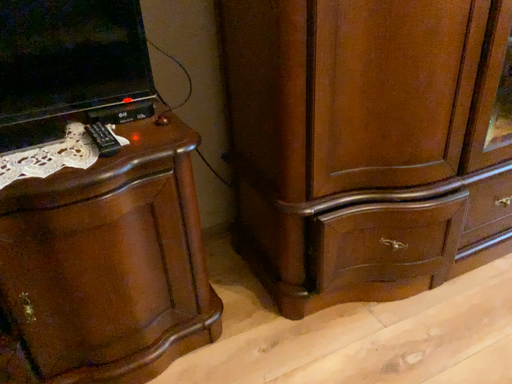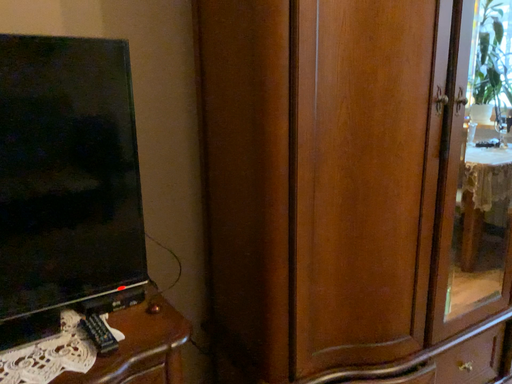
Question: Which way did the camera rotate in the video?

Choices:
 (A) rotated downward
 (B) rotated upward

Answer: (B)